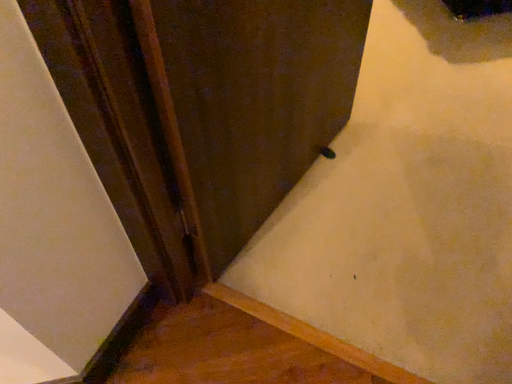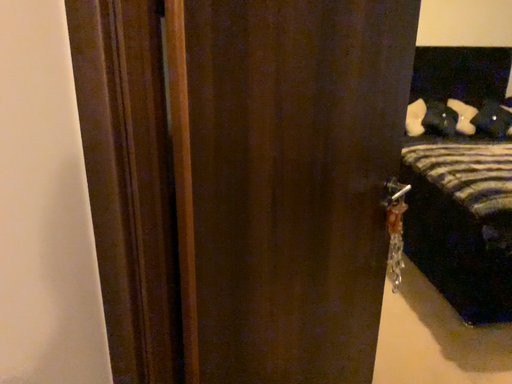
Question: Which way did the camera rotate in the video?

Choices:
 (A) rotated downward
 (B) rotated upward

Answer: (B)